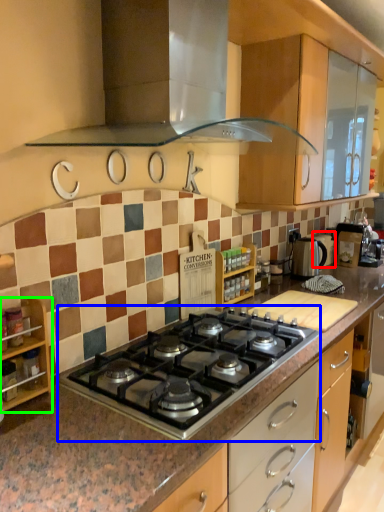
Question: Estimate the real-world distances between objects in this image. Which object is farther from appliance (highlighted by a red box), gas stove (highlighted by a blue box) or shelf (highlighted by a green box)?

Choices:
 (A) gas stove
 (B) shelf

Answer: (B)